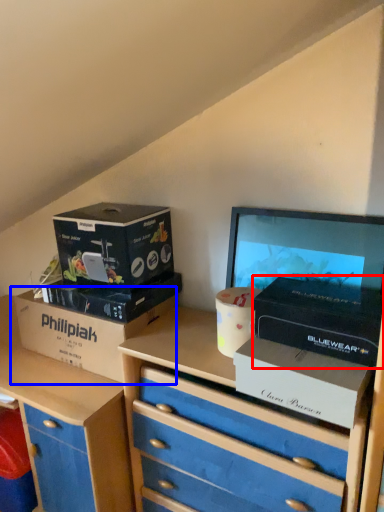
Question: Which object appears farthest to the camera in this image, box (highlighted by a red box) or box (highlighted by a blue box)?

Choices:
 (A) box
 (B) box

Answer: (B)